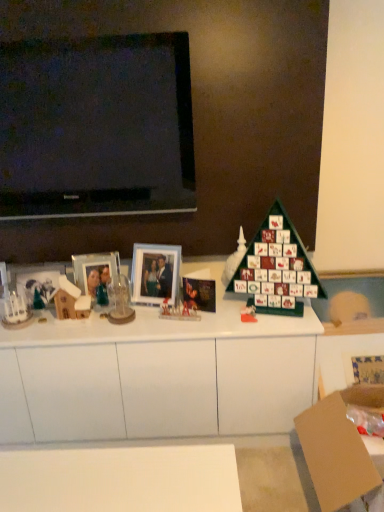
Where is `free spot in front of glossy paper christmas card at center`? This screenshot has width=384, height=512. free spot in front of glossy paper christmas card at center is located at coordinates (210, 324).